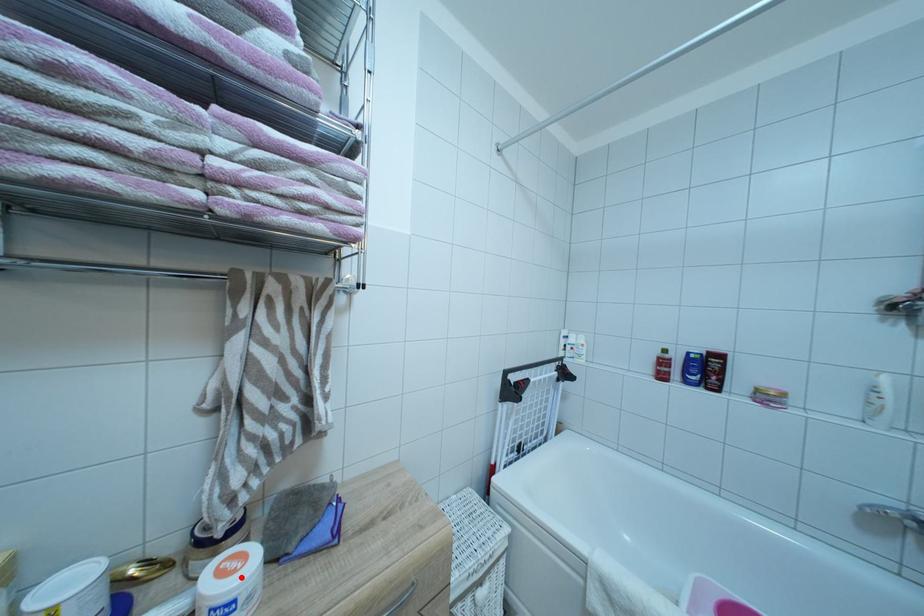
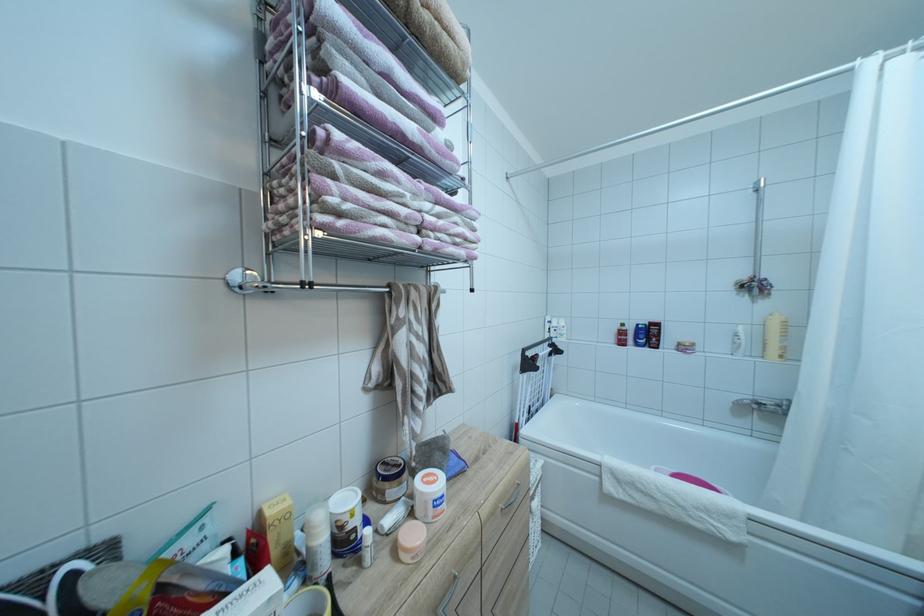
The point at the highlighted location is marked in the first image. Where is the corresponding point in the second image?

(442, 487)